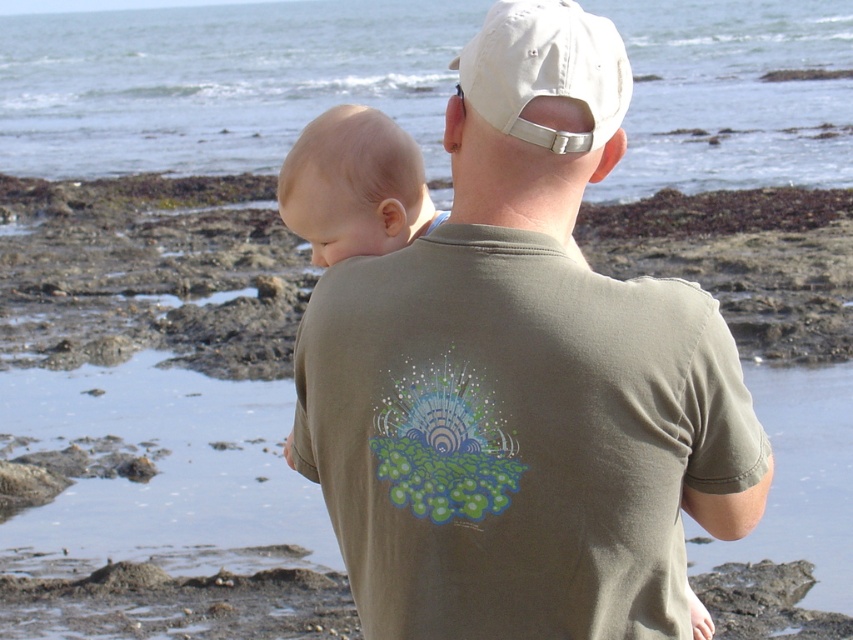
You are a photographer trying to capture the clear blue water at upper center in the image. Based on its position, can you estimate where you should aim your camera relative to the man and the baby?

The clear blue water at upper center is located at point coordinates approximately 0.128 along the horizontal axis and 0.256 along the vertical axis. This places it slightly to the left and higher up than the man and baby, so aim your camera slightly to the left and upwards from their position.

In the scene shown: You are a photographer trying to capture the clear blue water at upper center and the white fabric baseball cap at upper center in the same frame. Based on their positions, which object appears taller in the photo?

The clear blue water at upper center appears taller in the photo because it has a greater height compared to the white fabric baseball cap at upper center.

You are a photographer trying to capture a closeup of the smooth beige baby at center. The clear blue water at upper center is obstructing your view. Can you adjust your camera angle to focus on the baby without the water being in the shot?

The clear blue water at upper center is larger in size than the smooth beige baby at center, so adjusting the camera angle downward might help focus on the baby while avoiding the water obstruction.